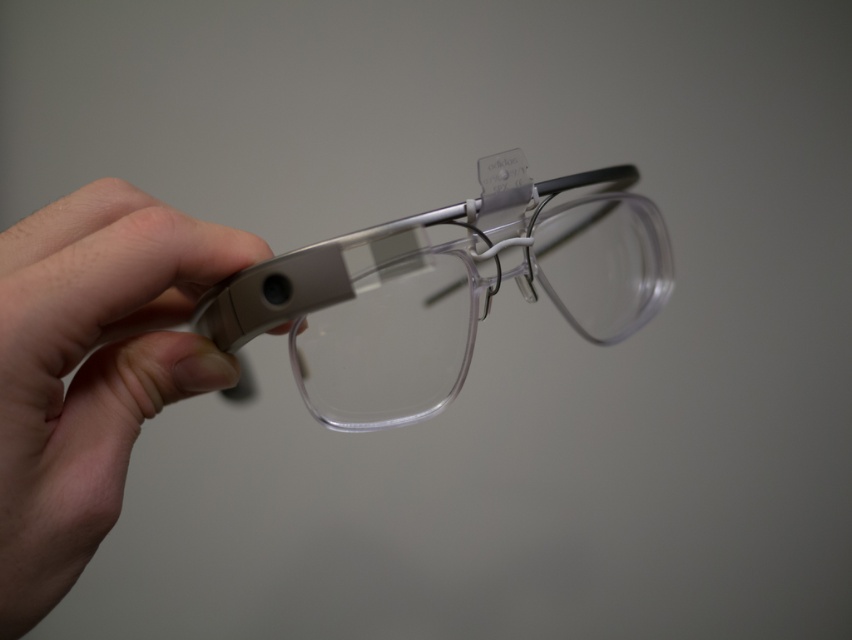
Is point (191, 285) farther from viewer compared to point (630, 264)?

No, it is in front of (630, 264).

Does point (209, 356) come closer to viewer compared to point (671, 275)?

Yes, it is.

What are the coordinates of `skin tone flesh hand at left` in the screenshot? It's located at (91, 369).